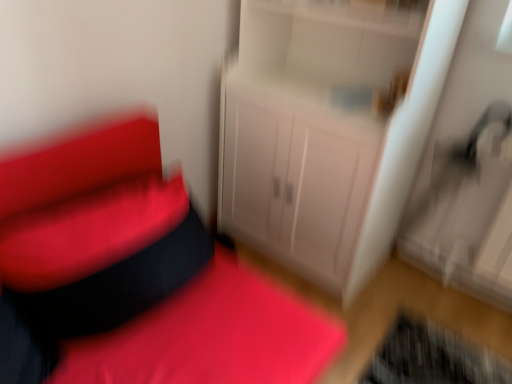
In order to face metallic silver swivel chair at right, should I rotate leftwards or rightwards?

Rotate right and turn 25.027 degrees.

Find the location of a particular element. This screenshot has width=512, height=384. white glossy cabinet at center is located at coordinates (318, 138).

Describe the element at coordinates (135, 277) in the screenshot. I see `matte white cabinet at center` at that location.

This screenshot has height=384, width=512. Find the location of `metallic silver swivel chair at right`. metallic silver swivel chair at right is located at coordinates (461, 189).

Does point (332, 150) appear closer or farther from the camera than point (40, 325)?

Point (332, 150) is farther from the camera than point (40, 325).

Where is `furniture located on the left of white glossy cabinet at center`? furniture located on the left of white glossy cabinet at center is located at coordinates (135, 277).

Which of these two, white glossy cabinet at center or matte white cabinet at center, is wider?

Wider between the two is matte white cabinet at center.

Does white glossy cabinet at center appear on the left side of matte white cabinet at center?

Incorrect, white glossy cabinet at center is not on the left side of matte white cabinet at center.

Consider the image. Which is more to the left, metallic silver swivel chair at right or white glossy cabinet at center?

Positioned to the left is white glossy cabinet at center.

Would you say metallic silver swivel chair at right contains white glossy cabinet at center?

No, white glossy cabinet at center is not surrounded by metallic silver swivel chair at right.

From a real-world perspective, between metallic silver swivel chair at right and white glossy cabinet at center, who is vertically lower?

metallic silver swivel chair at right is physically lower.

Is the surface of metallic silver swivel chair at right in direct contact with white glossy cabinet at center?

No.

What's the angular difference between matte white cabinet at center and white glossy cabinet at center's facing directions?

matte white cabinet at center and white glossy cabinet at center are facing 91.2 degrees away from each other.

Is matte white cabinet at center thinner than white glossy cabinet at center?

No.

Could white glossy cabinet at center be considered to be inside matte white cabinet at center?

No, white glossy cabinet at center is not inside matte white cabinet at center.

Is matte white cabinet at center facing away from white glossy cabinet at center?

No, white glossy cabinet at center is not at the back of matte white cabinet at center.

Between white glossy cabinet at center and metallic silver swivel chair at right, which one has smaller size?

With smaller size is metallic silver swivel chair at right.

From the image's perspective, which is above, white glossy cabinet at center or metallic silver swivel chair at right?

From the image's view, white glossy cabinet at center is above.

Image resolution: width=512 pixels, height=384 pixels. In order to click on swivel chair to the right of white glossy cabinet at center in this screenshot , I will do `click(461, 189)`.

Does white glossy cabinet at center have a greater height compared to metallic silver swivel chair at right?

Yes, white glossy cabinet at center is taller than metallic silver swivel chair at right.

How different are the orientations of metallic silver swivel chair at right and matte white cabinet at center in degrees?

89.6 degrees separate the facing orientations of metallic silver swivel chair at right and matte white cabinet at center.

I want to click on swivel chair that appears behind the matte white cabinet at center, so click(461, 189).

Who is smaller, metallic silver swivel chair at right or matte white cabinet at center?

Smaller between the two is metallic silver swivel chair at right.

Which is less distant, (486, 220) or (146, 246)?

Point (486, 220) is farther from the camera than point (146, 246).

Considering the points (232, 301) and (480, 157), which point is in front, point (232, 301) or point (480, 157)?

The point (232, 301) is closer.

How different are the orientations of matte white cabinet at center and metallic silver swivel chair at right in degrees?

The facing directions of matte white cabinet at center and metallic silver swivel chair at right are 89.6 degrees apart.

This screenshot has height=384, width=512. In order to click on swivel chair that appears above the matte white cabinet at center (from the image's perspective) in this screenshot , I will do `click(461, 189)`.

From a real-world perspective, is matte white cabinet at center under metallic silver swivel chair at right?

Yes, from a real-world perspective, matte white cabinet at center is below metallic silver swivel chair at right.

At what (x,y) coordinates should I click in order to perform the action: click on dresser above the matte white cabinet at center (from a real-world perspective). Please return your answer as a coordinate pair (x, y). Looking at the image, I should click on (318, 138).

The image size is (512, 384). Identify the location of dresser that is above the metallic silver swivel chair at right (from the image's perspective). (318, 138).

Based on their spatial positions, is metallic silver swivel chair at right or matte white cabinet at center further from white glossy cabinet at center?

matte white cabinet at center is positioned further to the anchor white glossy cabinet at center.

Considering their positions, is matte white cabinet at center positioned further to metallic silver swivel chair at right than white glossy cabinet at center?

The object further to metallic silver swivel chair at right is matte white cabinet at center.

From the image, which object appears to be nearer to matte white cabinet at center, white glossy cabinet at center or metallic silver swivel chair at right?

Based on the image, white glossy cabinet at center appears to be nearer to matte white cabinet at center.

Based on their spatial positions, is metallic silver swivel chair at right or white glossy cabinet at center further from matte white cabinet at center?

The object further to matte white cabinet at center is metallic silver swivel chair at right.

Consider the image. Estimate the real-world distances between objects in this image. Which object is further from white glossy cabinet at center, matte white cabinet at center or metallic silver swivel chair at right?

Among the two, matte white cabinet at center is located further to white glossy cabinet at center.

Which object lies further to the anchor point metallic silver swivel chair at right, white glossy cabinet at center or matte white cabinet at center?

Among the two, matte white cabinet at center is located further to metallic silver swivel chair at right.

The width and height of the screenshot is (512, 384). I want to click on dresser between matte white cabinet at center and metallic silver swivel chair at right from left to right, so click(x=318, y=138).